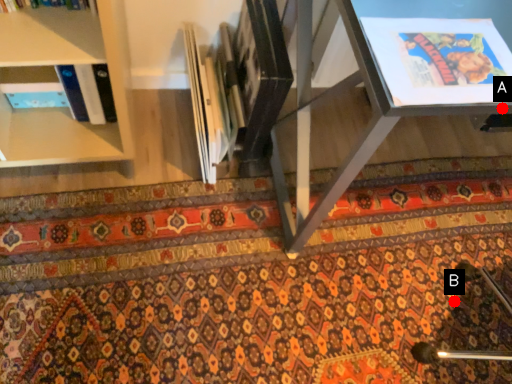
Question: Two points are circled on the image, labeled by A and B beside each circle. Which point is farther from the camera taking this photo?

Choices:
 (A) A is further
 (B) B is further

Answer: (B)